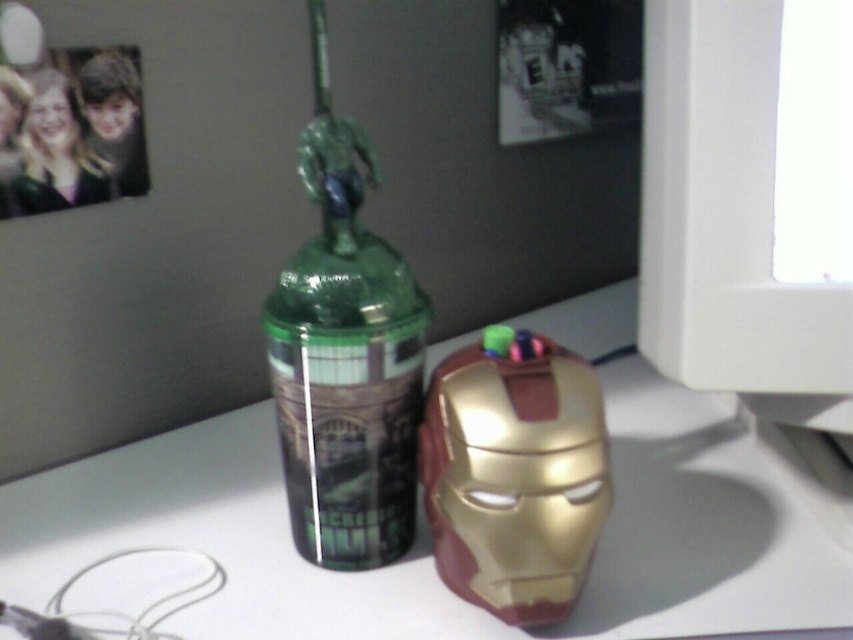
You are organizing items on your desk and need to place a new item between the white glossy table at center and the green glossy bottle at center. Which object should you place the item closer to if you want it to be higher up?

Since the green glossy bottle at center is taller than the white glossy table at center, you should place the item closer to the green glossy bottle at center to have it higher up.

You are organizing a superhero themed party and need to place a 10 cm tall action figure between the green glossy bottle at center and the gold metallic iron man mask at center on the desk. Which object should the action figure be placed closer to if the bottle is larger?

The action figure should be placed closer to the gold metallic iron man mask at center because the green glossy bottle at center is larger and might take up more space, allowing the mask to have enough space for the action figure to be placed near it.